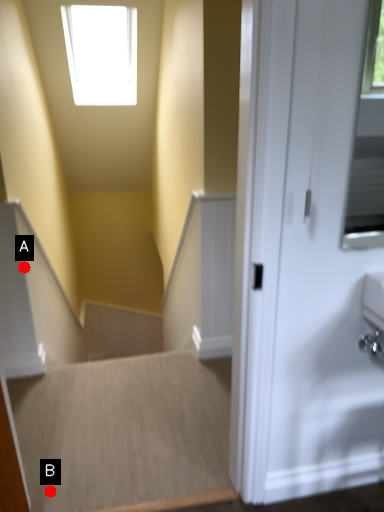
Question: Two points are circled on the image, labeled by A and B beside each circle. Which point is closer to the camera?

Choices:
 (A) A is closer
 (B) B is closer

Answer: (B)